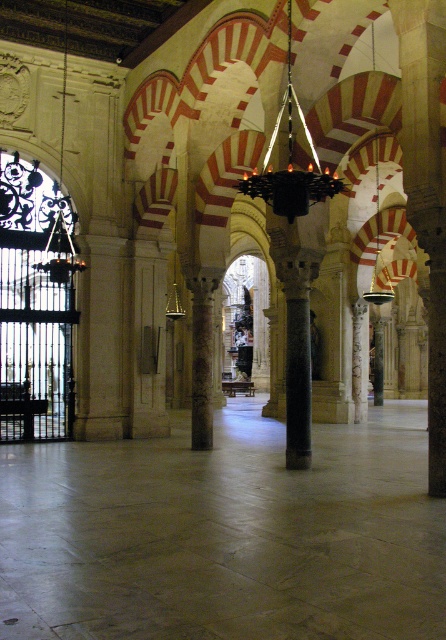
Question: Among these objects, which one is nearest to the camera?

Choices:
 (A) brown textured column at center
 (B) black matte chandelier at center

Answer: (B)

Question: Does black matte chandelier at center have a smaller size compared to brown textured column at center?

Choices:
 (A) no
 (B) yes

Answer: (B)

Question: In this image, where is black matte chandelier at center located relative to brown textured column at center?

Choices:
 (A) right
 (B) left

Answer: (A)

Question: Which point appears farthest from the camera in this image?

Choices:
 (A) (306, 172)
 (B) (206, 422)

Answer: (B)

Question: Is black matte chandelier at center wider than brown textured column at center?

Choices:
 (A) yes
 (B) no

Answer: (B)